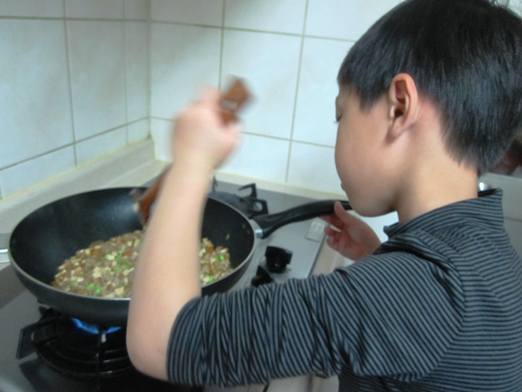
Find the location of a particular element. skillet handle is located at coordinates (279, 222).